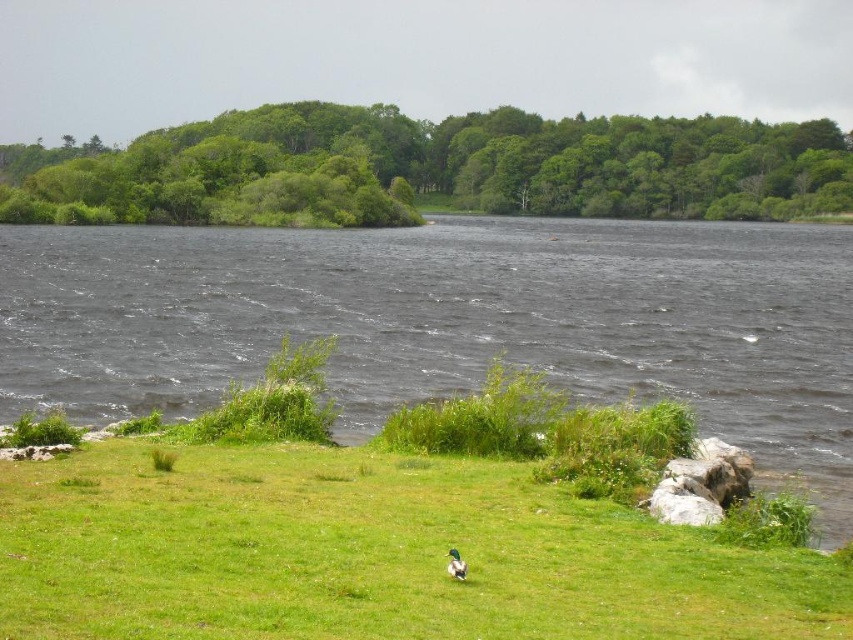
Does green grassy at lower center have a greater width compared to green leafy trees at upper center?

No.

Between point (218, 547) and point (711, 124), which one is positioned in front?

Point (218, 547) is more forward.

The width and height of the screenshot is (853, 640). Identify the location of green grassy at lower center. (372, 554).

Can you confirm if dark water at center is shorter than green leafy trees at upper center?

Correct, dark water at center is not as tall as green leafy trees at upper center.

Measure the distance between dark water at center and camera.

dark water at center is 53.86 feet away from camera.

At what (x,y) coordinates should I click in order to perform the action: click on dark water at center. Please return your answer as a coordinate pair (x, y). Looking at the image, I should click on (453, 323).

This screenshot has height=640, width=853. What do you see at coordinates (701, 483) in the screenshot? I see `gray rock at lower right` at bounding box center [701, 483].

Is gray rock at lower right further to the viewer compared to green glossy duck at center?

That is True.

This screenshot has height=640, width=853. Find the location of `gray rock at lower right`. gray rock at lower right is located at coordinates (701, 483).